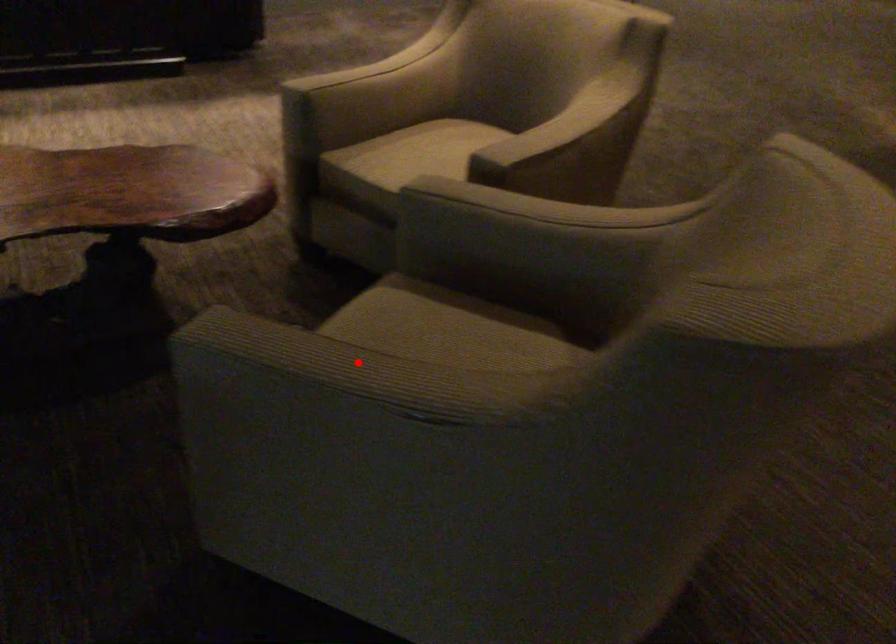
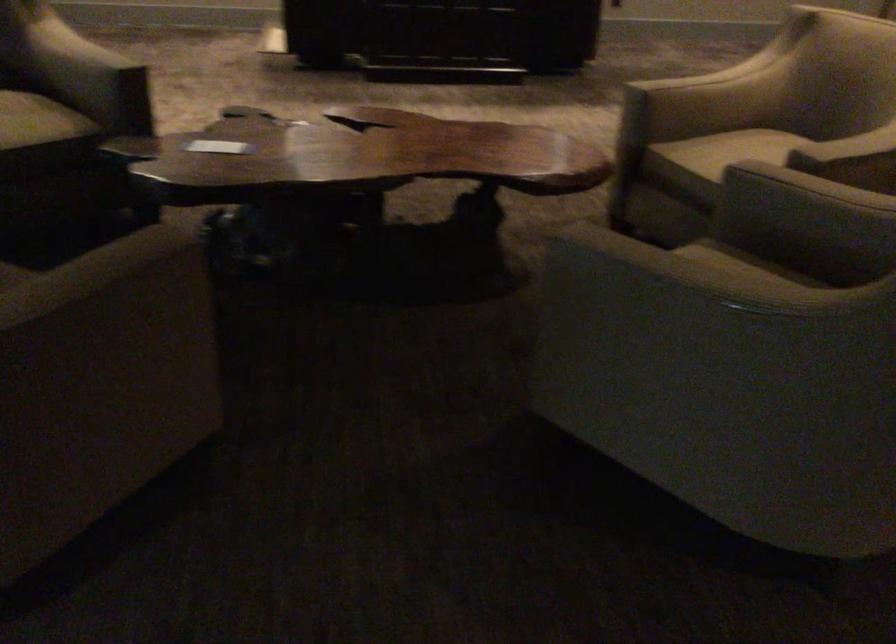
Question: I am providing you with two images of the same scene from different viewpoints. Given a red point in image1, look at the same physical point in image2. Is it:

Choices:
 (A) Closer to the viewpoint
 (B) Farther from the viewpoint

Answer: (B)